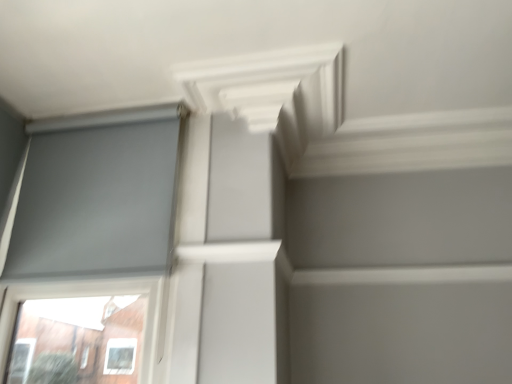
In the scene shown: What is the approximate height of matte gray screen at left?

The height of matte gray screen at left is 28.38 inches.

The height and width of the screenshot is (384, 512). Describe the element at coordinates (96, 202) in the screenshot. I see `matte gray screen at left` at that location.

Image resolution: width=512 pixels, height=384 pixels. Identify the location of matte gray screen at left. (96, 202).

Measure the distance between point (341, 112) and camera.

Point (341, 112) is 1.80 meters away from camera.

At what (x,y) coordinates should I click in order to perform the action: click on white matte exhaust hood at upper center. Please return your answer as a coordinate pair (x, y). This screenshot has width=512, height=384. Looking at the image, I should click on (273, 92).

What is the approximate height of white matte exhaust hood at upper center?

white matte exhaust hood at upper center is 5.26 inches tall.

Describe the element at coordinates (273, 92) in the screenshot. This screenshot has height=384, width=512. I see `white matte exhaust hood at upper center` at that location.

Locate an element on the screen. The width and height of the screenshot is (512, 384). matte gray screen at left is located at coordinates (96, 202).

Does white matte exhaust hood at upper center appear on the right side of matte gray screen at left?

Indeed, white matte exhaust hood at upper center is positioned on the right side of matte gray screen at left.

Which is in front, white matte exhaust hood at upper center or matte gray screen at left?

white matte exhaust hood at upper center is more forward.

Is point (224, 82) positioned after point (59, 156)?

No, it is not.

From the image's perspective, is white matte exhaust hood at upper center located above or below matte gray screen at left?

white matte exhaust hood at upper center is above matte gray screen at left.

From a real-world perspective, between white matte exhaust hood at upper center and matte gray screen at left, who is vertically lower?

matte gray screen at left, from a real-world perspective.

Which object is wider, white matte exhaust hood at upper center or matte gray screen at left?

Wider between the two is white matte exhaust hood at upper center.

Based on the photo, is white matte exhaust hood at upper center shorter than matte gray screen at left?

Correct, white matte exhaust hood at upper center is not as tall as matte gray screen at left.

Considering the sizes of white matte exhaust hood at upper center and matte gray screen at left in the image, is white matte exhaust hood at upper center bigger or smaller than matte gray screen at left?

white matte exhaust hood at upper center is smaller than matte gray screen at left.

Do you think white matte exhaust hood at upper center is within matte gray screen at left, or outside of it?

white matte exhaust hood at upper center exists outside the volume of matte gray screen at left.

Is white matte exhaust hood at upper center next to matte gray screen at left?

No.

Is white matte exhaust hood at upper center looking in the opposite direction of matte gray screen at left?

white matte exhaust hood at upper center is not turned away from matte gray screen at left.

What's the angular difference between white matte exhaust hood at upper center and matte gray screen at left's facing directions?

The angle between the facing direction of white matte exhaust hood at upper center and the facing direction of matte gray screen at left is 0.0314 degrees.

I want to click on exhaust hood in front of the matte gray screen at left, so click(x=273, y=92).

Between matte gray screen at left and white matte exhaust hood at upper center, which one appears on the right side from the viewer's perspective?

white matte exhaust hood at upper center is more to the right.

Does matte gray screen at left come in front of white matte exhaust hood at upper center?

No, it is behind white matte exhaust hood at upper center.

Is point (61, 210) less distant than point (285, 107)?

Yes, it is.

From the image's perspective, which one is positioned lower, matte gray screen at left or white matte exhaust hood at upper center?

From the image's view, matte gray screen at left is below.

From a real-world perspective, is matte gray screen at left physically below white matte exhaust hood at upper center?

Yes, from a real-world perspective, matte gray screen at left is under white matte exhaust hood at upper center.

Looking at their sizes, would you say matte gray screen at left is wider or thinner than white matte exhaust hood at upper center?

Considering their sizes, matte gray screen at left looks slimmer than white matte exhaust hood at upper center.

Considering the sizes of objects matte gray screen at left and white matte exhaust hood at upper center in the image provided, who is taller, matte gray screen at left or white matte exhaust hood at upper center?

matte gray screen at left is taller.

Based on the photo, considering the relative sizes of matte gray screen at left and white matte exhaust hood at upper center in the image provided, is matte gray screen at left bigger than white matte exhaust hood at upper center?

Yes, matte gray screen at left is bigger than white matte exhaust hood at upper center.

Would you say white matte exhaust hood at upper center is part of matte gray screen at left's contents?

No.

Consider the image. Is matte gray screen at left next to white matte exhaust hood at upper center?

No, matte gray screen at left is not making contact with white matte exhaust hood at upper center.

Does matte gray screen at left turn towards white matte exhaust hood at upper center?

No, matte gray screen at left is not facing towards white matte exhaust hood at upper center.

How many degrees apart are the facing directions of matte gray screen at left and white matte exhaust hood at upper center?

matte gray screen at left and white matte exhaust hood at upper center are facing 0.0314 degrees away from each other.

Locate an element on the screen. This screenshot has height=384, width=512. exhaust hood in front of the matte gray screen at left is located at coordinates (273, 92).

At what (x,y) coordinates should I click in order to perform the action: click on window screen located below the white matte exhaust hood at upper center (from the image's perspective). Please return your answer as a coordinate pair (x, y). Looking at the image, I should click on (96, 202).

This screenshot has height=384, width=512. Identify the location of exhaust hood that is above the matte gray screen at left (from a real-world perspective). (273, 92).